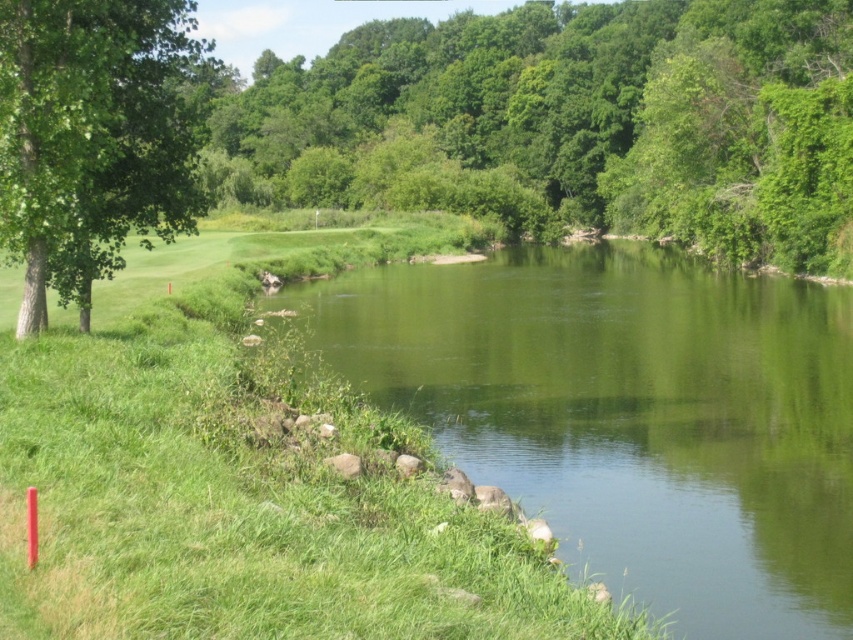
Question: Which object appears farthest from the camera in this image?

Choices:
 (A) green leafy tree at upper center
 (B) green leafy tree at left
 (C) green grassy golf course at lower left
 (D) green smooth water at center

Answer: (A)

Question: Can you confirm if green leafy tree at upper center is thinner than green leafy tree at left?

Choices:
 (A) yes
 (B) no

Answer: (B)

Question: Which is farther from the green leafy tree at upper center?

Choices:
 (A) green grassy golf course at lower left
 (B) green leafy tree at left

Answer: (A)

Question: Does green grassy golf course at lower left appear on the left side of green leafy tree at left?

Choices:
 (A) no
 (B) yes

Answer: (A)

Question: Among these objects, which one is nearest to the camera?

Choices:
 (A) green leafy tree at upper center
 (B) green leafy tree at left
 (C) green smooth water at center
 (D) green grassy golf course at lower left

Answer: (D)

Question: Can you confirm if green grassy golf course at lower left is positioned above green leafy tree at left?

Choices:
 (A) no
 (B) yes

Answer: (A)